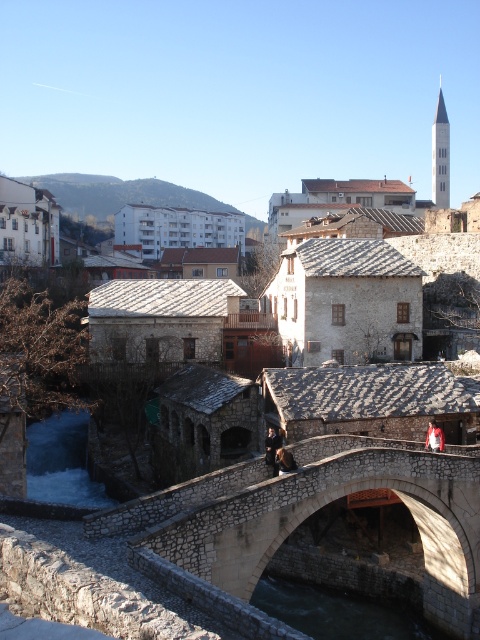
Question: Which of the following is the closest to the observer?

Choices:
 (A) (52, 435)
 (B) (423, 561)
 (C) (443, 435)

Answer: (C)

Question: Does white frothy water at lower left appear under red leather jacket at center?

Choices:
 (A) no
 (B) yes

Answer: (B)

Question: Which object is the closest to the red leather jacket at center?

Choices:
 (A) stone textured bridge at center
 (B) green stone water at lower center
 (C) white frothy water at lower left

Answer: (A)

Question: Can you confirm if stone textured bridge at center is positioned to the right of red leather jacket at center?

Choices:
 (A) no
 (B) yes

Answer: (A)

Question: Can you confirm if stone textured bridge at center is positioned to the right of white frothy water at lower left?

Choices:
 (A) no
 (B) yes

Answer: (B)

Question: Estimate the real-world distances between objects in this image. Which object is farther from the white frothy water at lower left?

Choices:
 (A) green stone water at lower center
 (B) stone textured bridge at center
 (C) red leather jacket at center

Answer: (C)